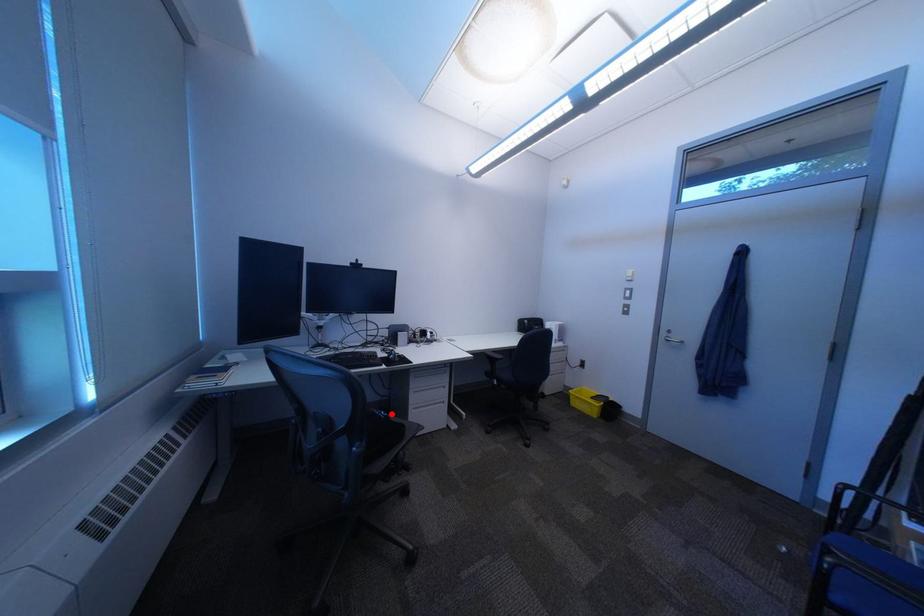
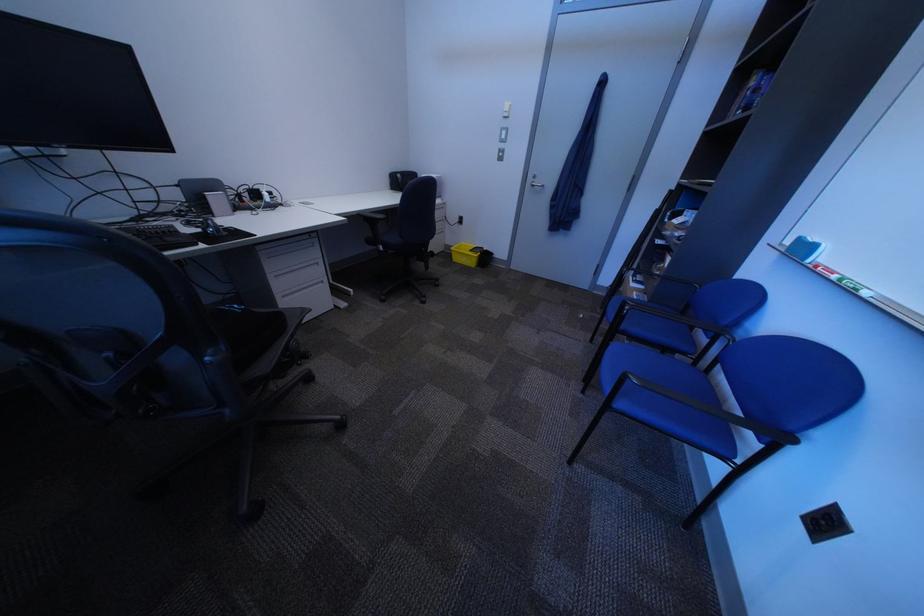
Find the pixel in the second image that matches the highlighted location in the first image.

(238, 310)